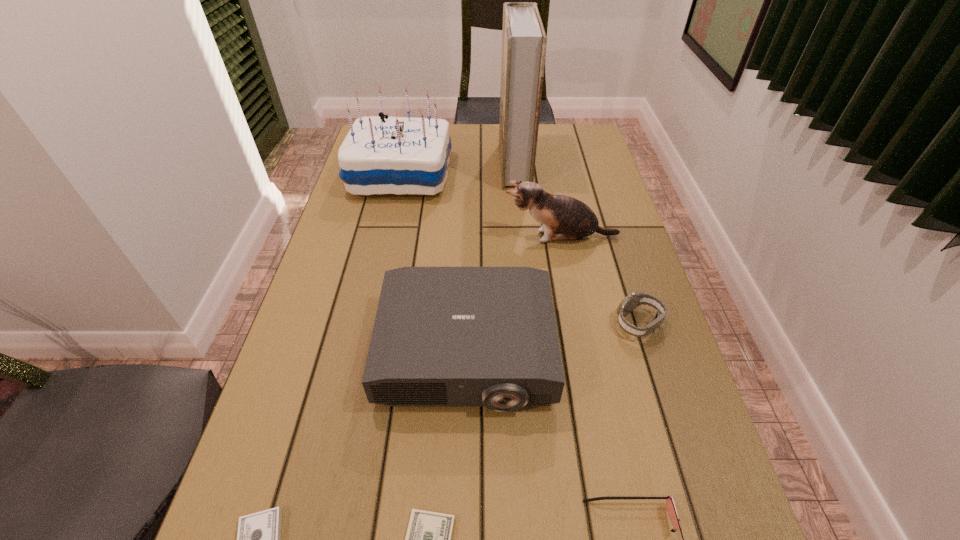
Locate an element on the screen. cat that is at the right edge is located at coordinates (563, 218).

At what (x,y) coordinates should I click in order to perform the action: click on watch that is at the right edge. Please return your answer as a coordinate pair (x, y). Looking at the image, I should click on (630, 302).

This screenshot has width=960, height=540. I want to click on object at the far left corner, so click(396, 155).

Locate an element on the screen. Image resolution: width=960 pixels, height=540 pixels. vacant space at the left edge of the desktop is located at coordinates (359, 267).

This screenshot has height=540, width=960. Find the location of `vacant space at the right edge of the desktop`. vacant space at the right edge of the desktop is located at coordinates (637, 361).

The image size is (960, 540). Identify the location of free space at the far right corner. (565, 127).

You are a GUI agent. You are given a task and a screenshot of the screen. Output one action in this format:
    pyautogui.click(x=<x>, y=<y>)
    Task: Click on the vacant point located between the watch and the tallest object
    This screenshot has width=960, height=540.
    Given the screenshot: What is the action you would take?
    pyautogui.click(x=576, y=244)

Locate an element on the screen. The height and width of the screenshot is (540, 960). the closest object to the sixth nearest object is located at coordinates (524, 41).

This screenshot has height=540, width=960. What are the coordinates of `object that is the seventh closest to the right dollar` in the screenshot? It's located at (524, 41).